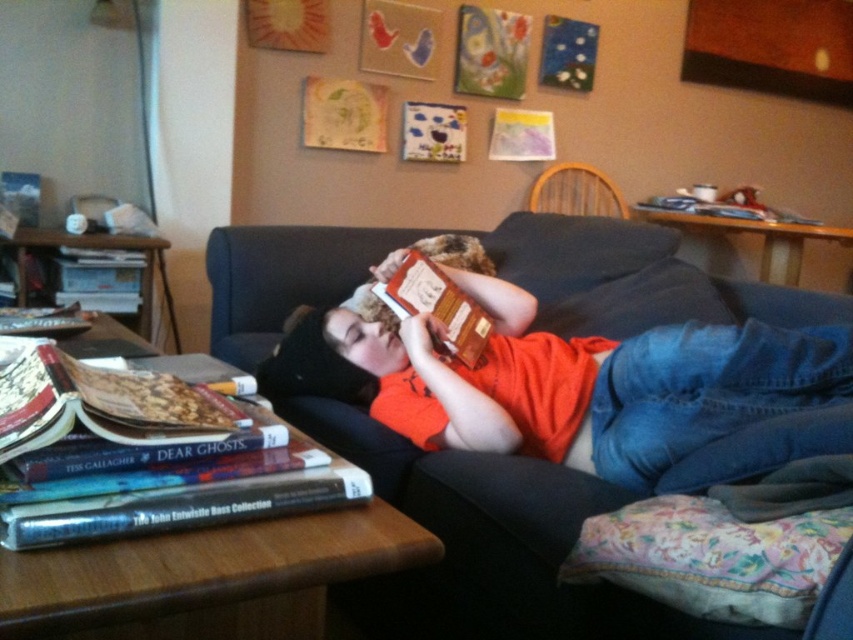
Question: Can you confirm if dark blue fabric couch at center is positioned to the left of orange fabric head at center?

Choices:
 (A) no
 (B) yes

Answer: (A)

Question: Considering the real-world distances, which object is farthest from the hardcover book at lower left?

Choices:
 (A) orange fabric head at center
 (B) wooden chair at upper center

Answer: (B)

Question: Which object is the closest to the hardcover book at lower left?

Choices:
 (A) wooden chair at upper center
 (B) orange fabric head at center
 (C) dark blue fabric couch at center

Answer: (B)

Question: Does hardcover book at lower left appear on the right side of orange fabric head at center?

Choices:
 (A) yes
 (B) no

Answer: (B)

Question: Which point is farther to the camera?

Choices:
 (A) dark blue fabric couch at center
 (B) wooden chair at upper center

Answer: (B)

Question: Is hardcover book at lower left positioned at the back of orange fabric head at center?

Choices:
 (A) no
 (B) yes

Answer: (A)